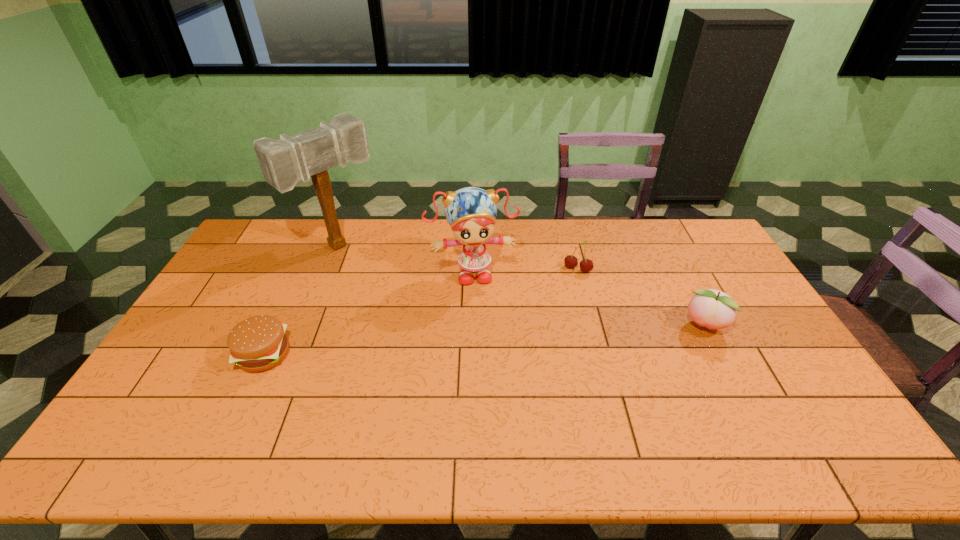
Image resolution: width=960 pixels, height=540 pixels. Identify the location of free spot on the desktop that is between the shortest object and the rightmost object and is positioned on the surface of the second object from right to left. (542, 336).

At what (x,y) coordinates should I click in order to perform the action: click on vacant space on the desktop that is between the shortest object and the rightmost object and is positioned on the face of the third object from left to right. Please return your answer as a coordinate pair (x, y). The width and height of the screenshot is (960, 540). Looking at the image, I should click on click(x=482, y=340).

Find the location of a particular element. The height and width of the screenshot is (540, 960). free space on the desktop that is between the shortest object and the peach and is positioned at the head of the mallet is located at coordinates (461, 342).